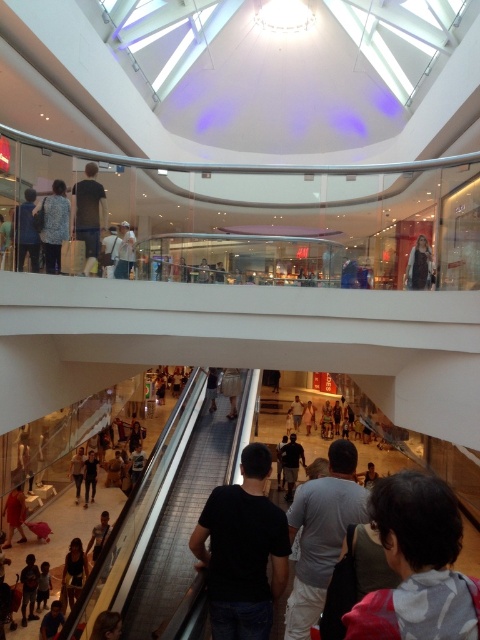
You are standing on the escalator in the mall and see a denim jacket at upper left. Where exactly is the denim jacket located in the image?

The denim jacket at upper left is located at point (25,232) in the image.

You are standing on the escalator in the mall and want to reach a point closer to you. Which of the two points, point (57,212) or point (231,419), is nearer to your current position?

Point (57,212) is closer to the viewer than point (231,419), so you should go to point (57,212).